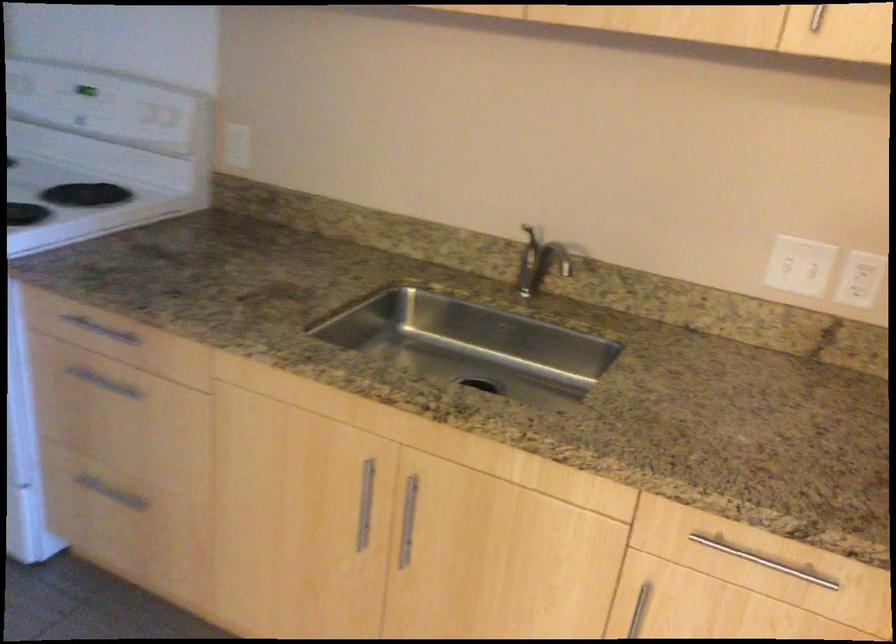
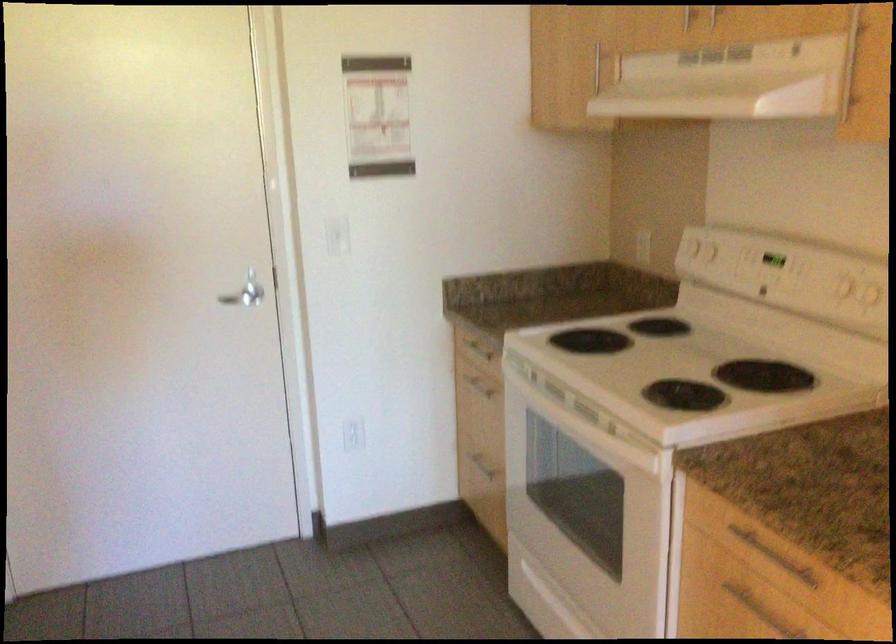
Question: The camera is either moving clockwise (left) or counter-clockwise (right) around the object. The first image is from the beginning of the video and the second image is from the end. Is the camera moving left or right when shooting the video?

Choices:
 (A) Left
 (B) Right

Answer: (B)